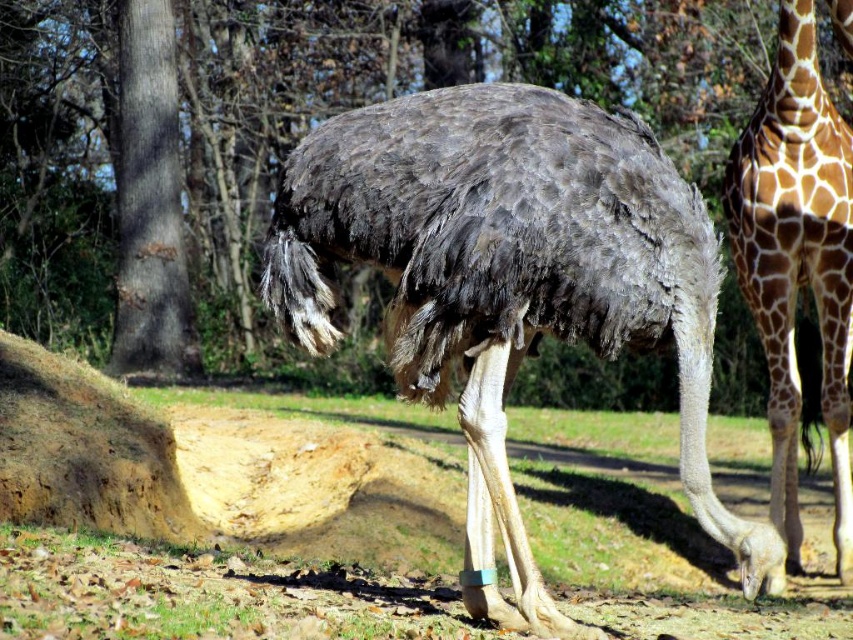
Question: Does brown textured bark at upper center have a larger size compared to gray rough bark tree at center?

Choices:
 (A) no
 (B) yes

Answer: (B)

Question: Which point appears farthest from the camera in this image?

Choices:
 (A) (398, 76)
 (B) (149, 88)
 (C) (598, 301)
 (D) (813, 232)

Answer: (A)

Question: Can you confirm if gray feathered ostrich at center is positioned below gray rough bark tree at center?

Choices:
 (A) no
 (B) yes

Answer: (B)

Question: Which is nearer to the gray feathered ostrich at center?

Choices:
 (A) gray rough bark tree at center
 (B) brown spotted fur at right

Answer: (B)

Question: Is brown textured bark at upper center wider than gray rough bark tree at center?

Choices:
 (A) yes
 (B) no

Answer: (A)

Question: Estimate the real-world distances between objects in this image. Which object is closer to the brown textured bark at upper center?

Choices:
 (A) brown spotted fur at right
 (B) gray rough bark tree at center

Answer: (B)